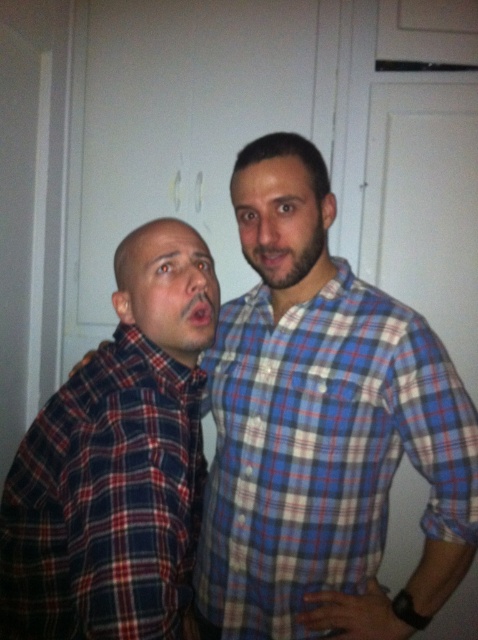
Can you confirm if blue plaid shirt at center is shorter than matte blue plaid shirt at center?

In fact, blue plaid shirt at center may be taller than matte blue plaid shirt at center.

At what (x,y) coordinates should I click in order to perform the action: click on blue plaid shirt at center. Please return your answer as a coordinate pair (x, y). This screenshot has height=640, width=478. Looking at the image, I should click on (323, 449).

I want to click on blue plaid shirt at center, so click(323, 449).

Where is `blue plaid shirt at center`? blue plaid shirt at center is located at coordinates (323, 449).

Describe the element at coordinates (323, 449) in the screenshot. I see `blue plaid shirt at center` at that location.

Between blue plaid shirt at center and red plaid shirt at left, which one is positioned lower?

red plaid shirt at left

Which is behind, point (410, 426) or point (55, 516)?

Point (410, 426)

Find the location of `blue plaid shirt at center`. blue plaid shirt at center is located at coordinates (323, 449).

Does blue plaid shirt at center have a greater width compared to matte plaid shirt at left?

Yes.

Which is more to the left, blue plaid shirt at center or matte plaid shirt at left?

Positioned to the left is matte plaid shirt at left.

Is point (368, 349) positioned behind point (165, 348)?

That is True.

At what (x,y) coordinates should I click in order to perform the action: click on blue plaid shirt at center. Please return your answer as a coordinate pair (x, y). This screenshot has width=478, height=640. Looking at the image, I should click on (323, 449).